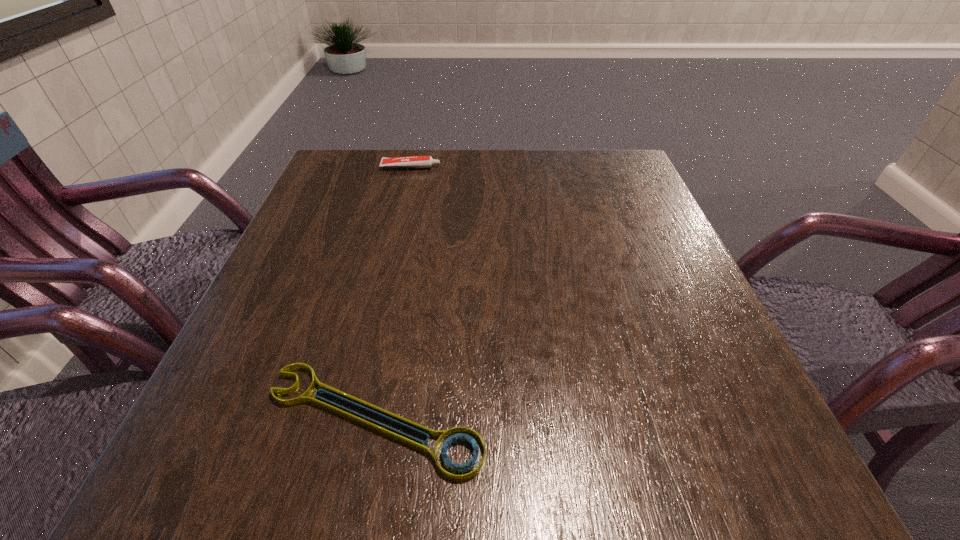
Locate an element on the screen. The height and width of the screenshot is (540, 960). the taller object is located at coordinates (413, 161).

Where is `toothpaste`? toothpaste is located at coordinates (413, 161).

Where is `the shorter object`? This screenshot has width=960, height=540. the shorter object is located at coordinates (460, 435).

At what (x,y) coordinates should I click in order to perform the action: click on the nearer object. Please return your answer as a coordinate pair (x, y). Looking at the image, I should click on (460, 435).

Where is `vacant space located 0.270m at the nozzle of the toothpaste`? This screenshot has height=540, width=960. vacant space located 0.270m at the nozzle of the toothpaste is located at coordinates (548, 167).

What are the coordinates of `free spot located on the right of the wrench` in the screenshot? It's located at (610, 419).

This screenshot has height=540, width=960. I want to click on object located at the far edge, so click(x=413, y=161).

Locate an element on the screen. The image size is (960, 540). object that is at the near edge is located at coordinates (460, 435).

You are a GUI agent. You are given a task and a screenshot of the screen. Output one action in this format:
    pyautogui.click(x=<x>, y=<y>)
    Task: Click on the toothpaste at the left edge
    
    Given the screenshot: What is the action you would take?
    pyautogui.click(x=413, y=161)

Image resolution: width=960 pixels, height=540 pixels. In order to click on wrench that is positioned at the left edge in this screenshot , I will do `click(460, 435)`.